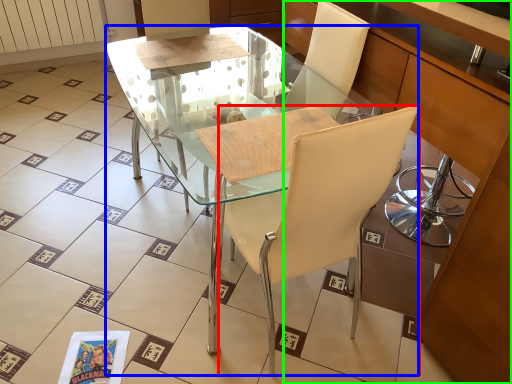
Question: Which is farther away from chair (highlighted by a red box)? desk (highlighted by a blue box) or cabinetry (highlighted by a green box)?

Choices:
 (A) desk
 (B) cabinetry

Answer: (B)